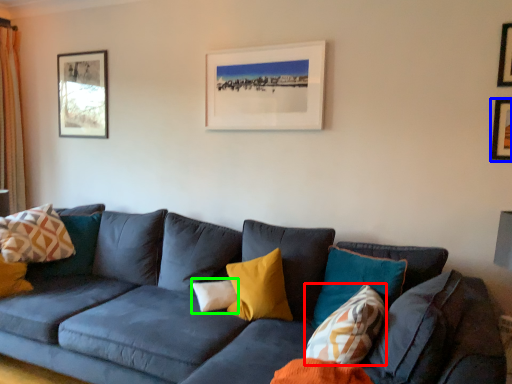
Question: Estimate the real-world distances between objects in this image. Which object is farther from pillow (highlighted by a red box), picture frame (highlighted by a blue box) or pillow (highlighted by a green box)?

Choices:
 (A) picture frame
 (B) pillow

Answer: (A)